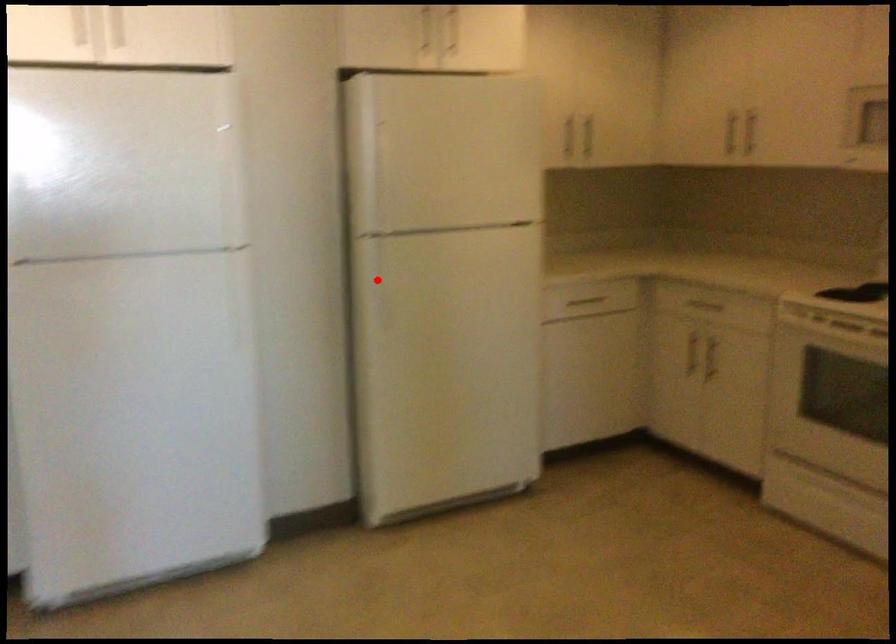
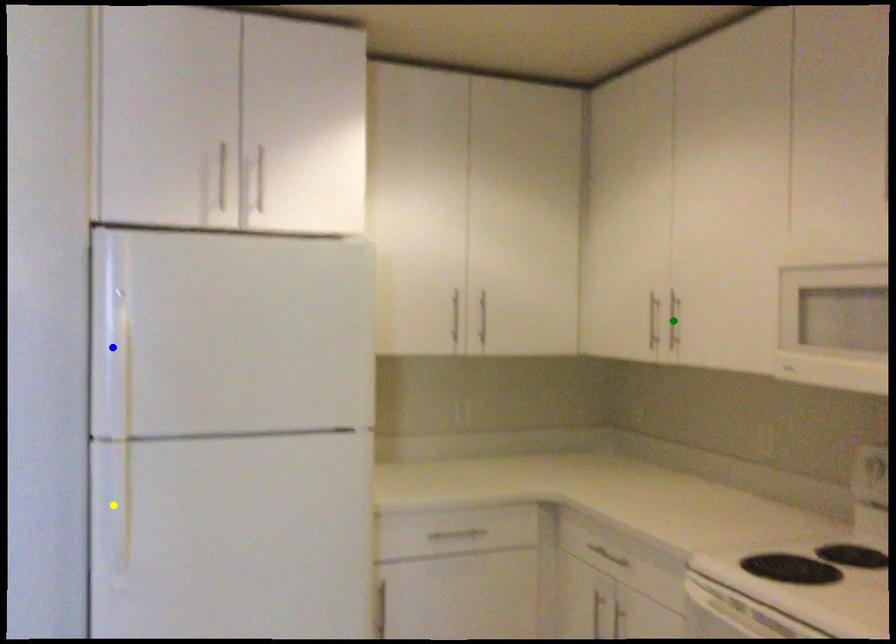
Question: I am providing you with two images of the same scene from different viewpoints. A red point is marked on the first image. You are given multiple points on the second image. Which mark in image 2 goes with the point in image 1?

Choices:
 (A) yellow point
 (B) green point
 (C) blue point

Answer: (A)